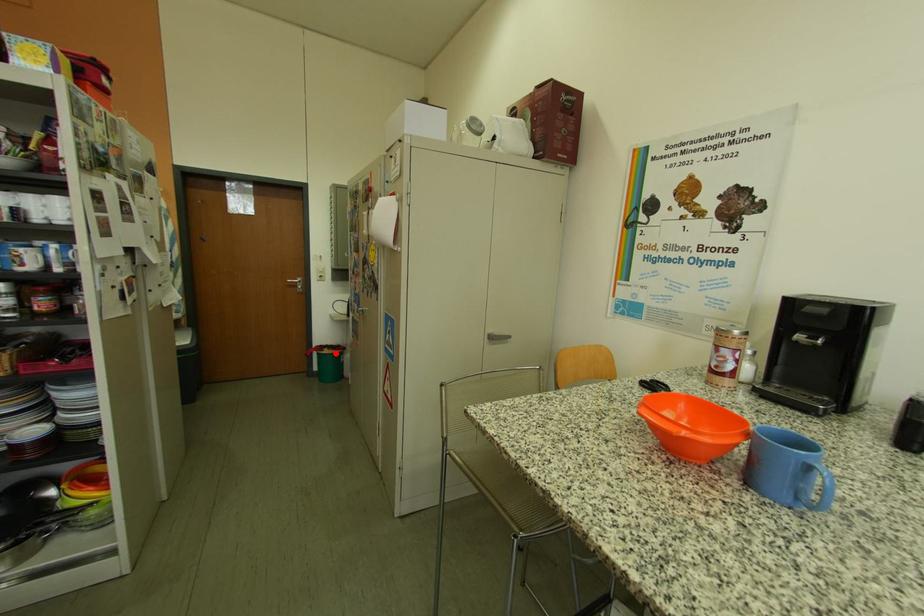
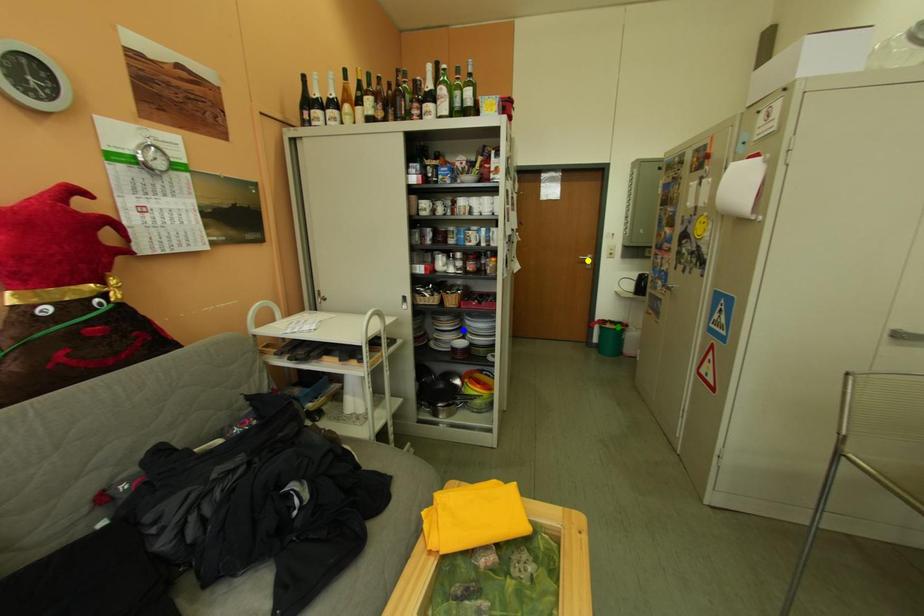
Question: I am providing you with two images of the same scene from different viewpoints. A red point is marked on the first image. You are given multiple points on the second image. Can you choose the point in image 2 that corresponds to the point in image 1?

Choices:
 (A) blue point
 (B) yellow point
 (C) green point

Answer: (C)